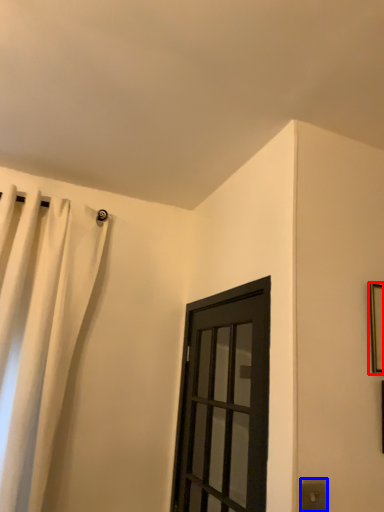
Question: Which of the following is the farthest to the observer, picture frame (highlighted by a red box) or electric outlet (highlighted by a blue box)?

Choices:
 (A) picture frame
 (B) electric outlet

Answer: (A)